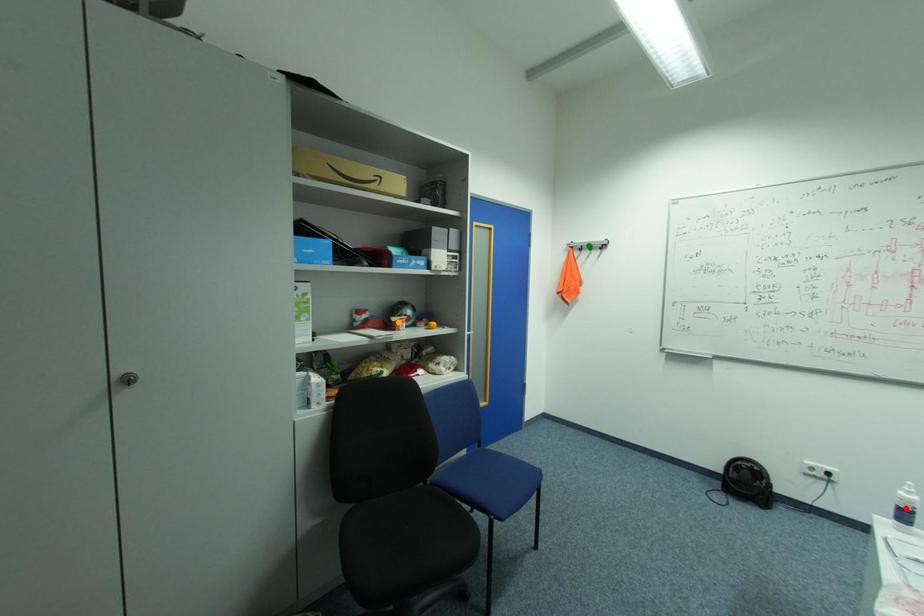
Order these from nearest to farthest:
A) red point
B) green point
C) orange point

red point < orange point < green point